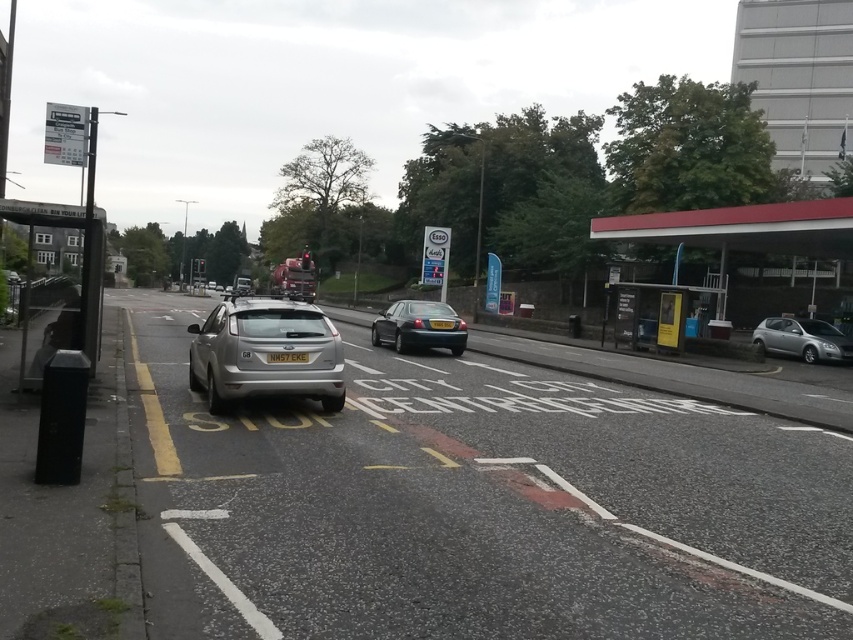
Question: Does silver metallic car at center come behind metallic blue sedan at center?

Choices:
 (A) no
 (B) yes

Answer: (A)

Question: Which point is closer to the camera?

Choices:
 (A) yellow matte license plate at center
 (B) metallic blue sedan at center

Answer: (A)

Question: Can you confirm if yellow matte license plate at center is bigger than yellow plastic license plate at center?

Choices:
 (A) yes
 (B) no

Answer: (B)

Question: Which object is closer to the camera taking this photo?

Choices:
 (A) yellow matte license plate at center
 (B) yellow plastic license plate at center
 (C) silver metallic hatchback at right
 (D) silver metallic car at center

Answer: (D)

Question: Which of the following is the farthest from the observer?

Choices:
 (A) (x=299, y=353)
 (B) (x=836, y=342)

Answer: (B)

Question: Is silver metallic hatchback at center thinner than yellow matte license plate at center?

Choices:
 (A) no
 (B) yes

Answer: (B)